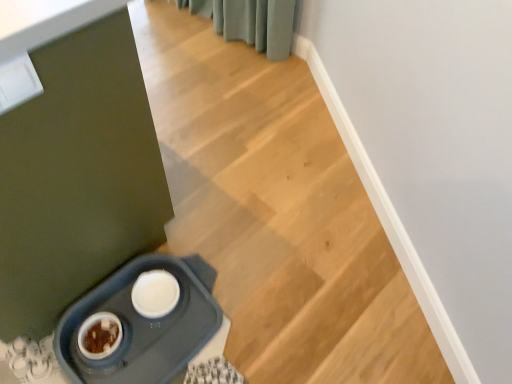
Where is `matte plastic pet feeder at lower left`? This screenshot has width=512, height=384. matte plastic pet feeder at lower left is located at coordinates (143, 325).

The height and width of the screenshot is (384, 512). Describe the element at coordinates (143, 325) in the screenshot. I see `matte plastic pet feeder at lower left` at that location.

The height and width of the screenshot is (384, 512). Describe the element at coordinates (277, 213) in the screenshot. I see `wooden stairs at center` at that location.

Where is `wooden stairs at center`? The width and height of the screenshot is (512, 384). wooden stairs at center is located at coordinates (277, 213).

Identify the location of matte plastic pet feeder at lower left. Image resolution: width=512 pixels, height=384 pixels. (143, 325).

Considering the relative positions of wooden stairs at center and matte plastic pet feeder at lower left in the image provided, is wooden stairs at center to the left of matte plastic pet feeder at lower left from the viewer's perspective?

Yes, wooden stairs at center is to the left of matte plastic pet feeder at lower left.

Is wooden stairs at center positioned in front of matte plastic pet feeder at lower left?

Yes, wooden stairs at center is in front of matte plastic pet feeder at lower left.

Between point (323, 254) and point (155, 358), which one is positioned in front?

The point (155, 358) is in front.

From the image's perspective, is wooden stairs at center beneath matte plastic pet feeder at lower left?

No.

From a real-world perspective, does wooden stairs at center stand above matte plastic pet feeder at lower left?

No.

Is wooden stairs at center thinner than matte plastic pet feeder at lower left?

No.

From their relative heights in the image, would you say wooden stairs at center is taller or shorter than matte plastic pet feeder at lower left?

Considering their sizes, wooden stairs at center has less height than matte plastic pet feeder at lower left.

In the scene shown: Can you confirm if wooden stairs at center is smaller than matte plastic pet feeder at lower left?

Incorrect, wooden stairs at center is not smaller in size than matte plastic pet feeder at lower left.

Is wooden stairs at center inside the boundaries of matte plastic pet feeder at lower left, or outside?

wooden stairs at center exists outside the volume of matte plastic pet feeder at lower left.

Is wooden stairs at center not near matte plastic pet feeder at lower left?

wooden stairs at center is near matte plastic pet feeder at lower left, not far away.

Is matte plastic pet feeder at lower left at the back of wooden stairs at center?

No, wooden stairs at center is not facing away from matte plastic pet feeder at lower left.

This screenshot has width=512, height=384. What are the coordinates of `appliance on the right of wooden stairs at center` in the screenshot? It's located at (143, 325).

Which is more to the right, matte plastic pet feeder at lower left or wooden stairs at center?

matte plastic pet feeder at lower left.

Is matte plastic pet feeder at lower left in front of or behind wooden stairs at center in the image?

Clearly, matte plastic pet feeder at lower left is behind wooden stairs at center.

Is point (205, 289) closer or farther from the camera than point (287, 101)?

Point (205, 289) is positioned closer to the camera compared to point (287, 101).

From the image's perspective, is matte plastic pet feeder at lower left on wooden stairs at center?

No, from the image's perspective, matte plastic pet feeder at lower left is not above wooden stairs at center.

From a real-world perspective, is matte plastic pet feeder at lower left below wooden stairs at center?

Actually, matte plastic pet feeder at lower left is physically above wooden stairs at center in the real world.

Looking at this image, considering the sizes of objects matte plastic pet feeder at lower left and wooden stairs at center in the image provided, who is thinner, matte plastic pet feeder at lower left or wooden stairs at center?

With smaller width is matte plastic pet feeder at lower left.

Considering the sizes of objects matte plastic pet feeder at lower left and wooden stairs at center in the image provided, who is taller, matte plastic pet feeder at lower left or wooden stairs at center?

With more height is matte plastic pet feeder at lower left.

Who is smaller, matte plastic pet feeder at lower left or wooden stairs at center?

With smaller size is matte plastic pet feeder at lower left.

Is matte plastic pet feeder at lower left inside or outside of wooden stairs at center?

matte plastic pet feeder at lower left exists outside the volume of wooden stairs at center.

Would you consider matte plastic pet feeder at lower left to be distant from wooden stairs at center?

matte plastic pet feeder at lower left is actually quite close to wooden stairs at center.

Looking at this image, is matte plastic pet feeder at lower left oriented towards wooden stairs at center?

No.

Identify the location of stairs located above the matte plastic pet feeder at lower left (from the image's perspective). (277, 213).

At what (x,y) coordinates should I click in order to perform the action: click on appliance below the wooden stairs at center (from the image's perspective). Please return your answer as a coordinate pair (x, y). This screenshot has width=512, height=384. Looking at the image, I should click on (143, 325).

Where is `stairs beneath the matte plastic pet feeder at lower left (from a real-world perspective)`? This screenshot has height=384, width=512. stairs beneath the matte plastic pet feeder at lower left (from a real-world perspective) is located at coordinates (277, 213).